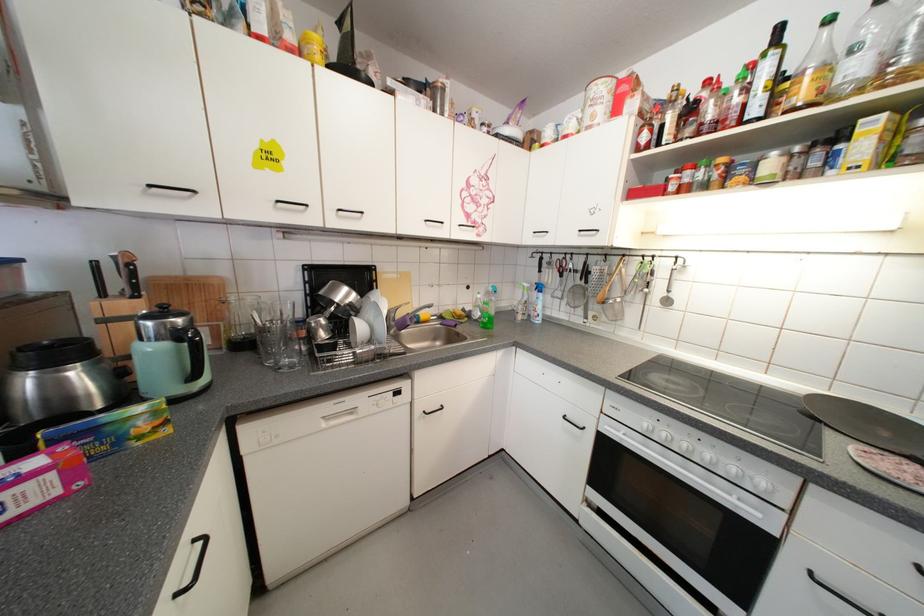
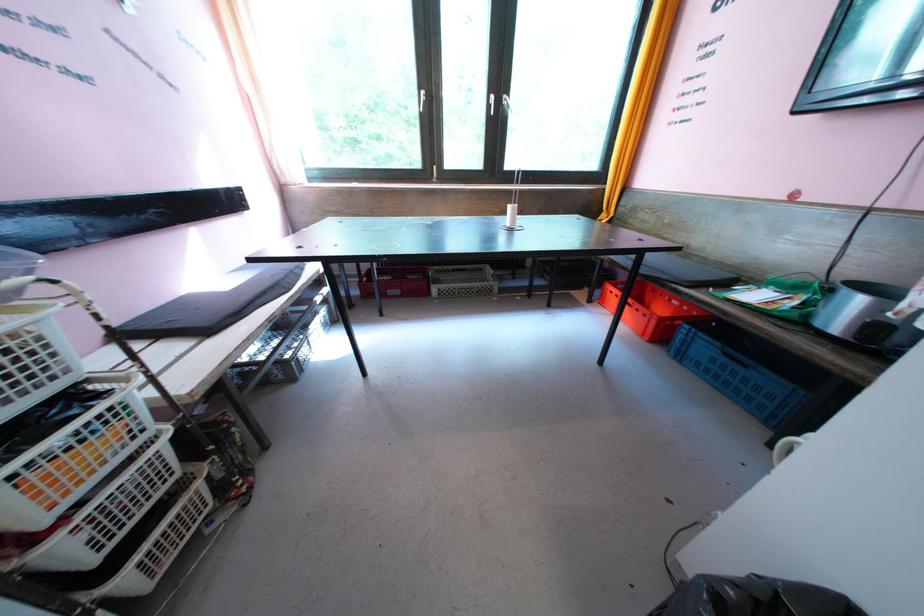
How did the camera likely rotate?

The camera's rotation is toward left-down.